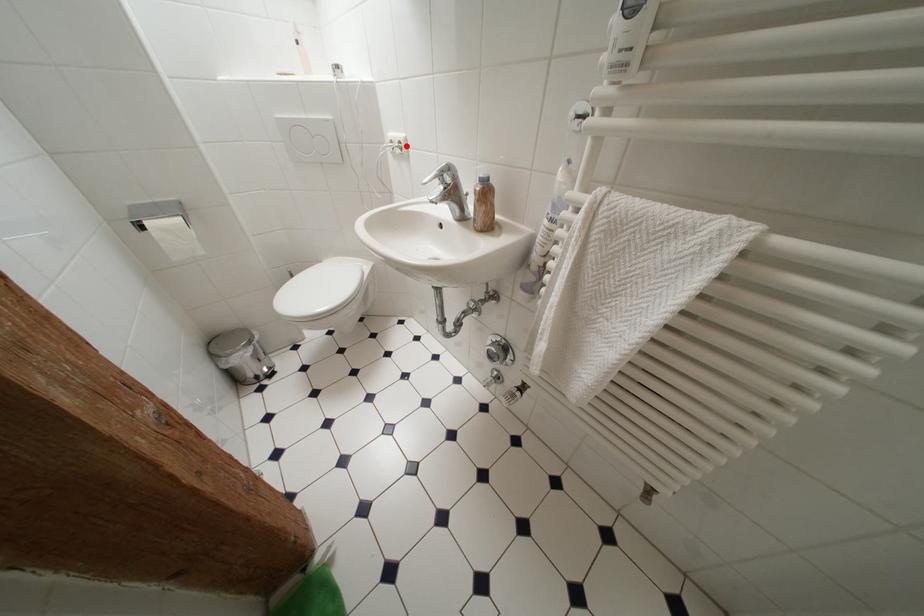
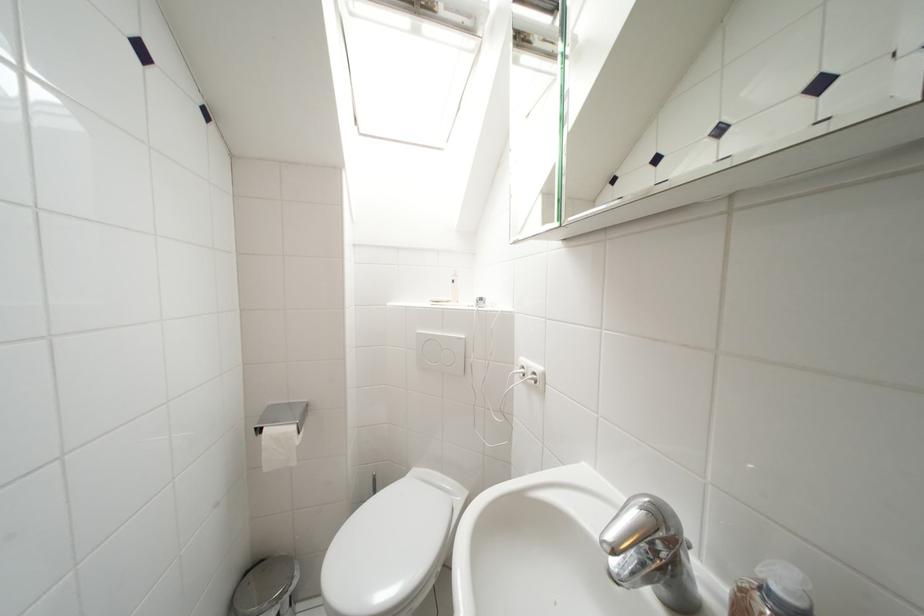
The point at the highlighted location is marked in the first image. Where is the corresponding point in the second image?

(541, 377)